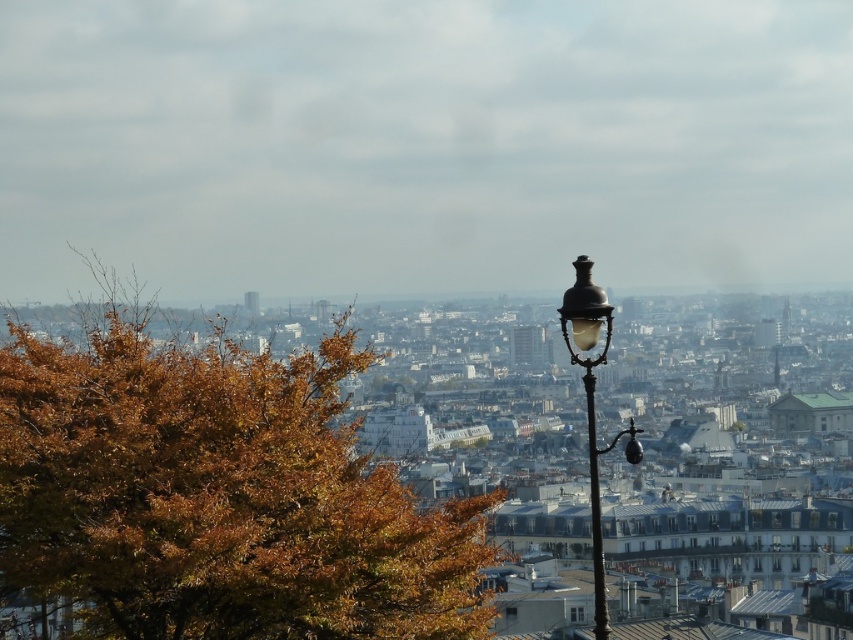
Question: Which point is farther from the camera taking this photo?

Choices:
 (A) (596, 554)
 (B) (602, 628)

Answer: (A)

Question: Is brown leafy tree at left to the left of bronze/brass street light at right from the viewer's perspective?

Choices:
 (A) yes
 (B) no

Answer: (A)

Question: Is brown leafy tree at left positioned at the back of black metal pole at right?

Choices:
 (A) yes
 (B) no

Answer: (B)

Question: Does brown leafy tree at left appear under bronze/brass street light at right?

Choices:
 (A) no
 (B) yes

Answer: (A)

Question: Which of the following is the farthest from the observer?

Choices:
 (A) click(x=39, y=582)
 (B) click(x=596, y=586)
 (C) click(x=604, y=636)

Answer: (B)

Question: Which point is closer to the camera?

Choices:
 (A) (601, 582)
 (B) (44, 573)
 (C) (577, 321)

Answer: (B)